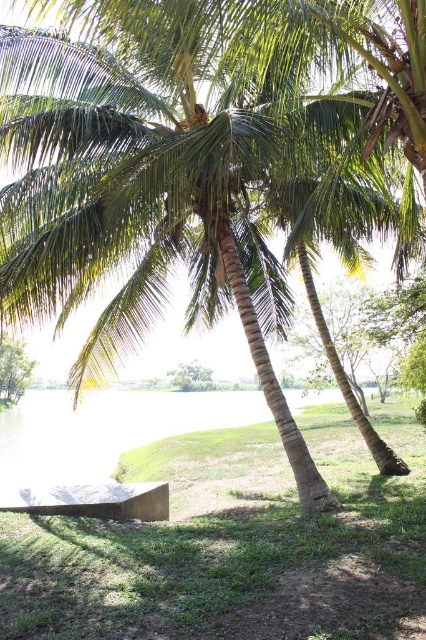
Consider the image. You are planning to plant a new palm tree in this tropical setting. The existing green leafy palm tree at lower left is wider than the green leafy tree at center. Considering their widths, which tree would require more space when planting?

The green leafy palm tree at lower left requires more space when planting because its width surpasses that of the green leafy tree at center.

You are planning to place a 2.5 meters wide picnic blanket on the grassy area. The wooden bench at lower left and the green leafy tree at center are in the way. Which object do you need to move to ensure the blanket fits without overlapping?

The wooden bench at lower left has a smaller width than the green leafy tree at center. Since the bench is narrower, moving it would allow more space for the 2.5 meters wide picnic blanket to fit without overlapping either object.

You are sitting on the wooden bench at lower left and want to look at the green leafy tree at center. Which direction should you look to see the tree?

The wooden bench at lower left is located above the green leafy tree at center, so you should look downward to see the tree.